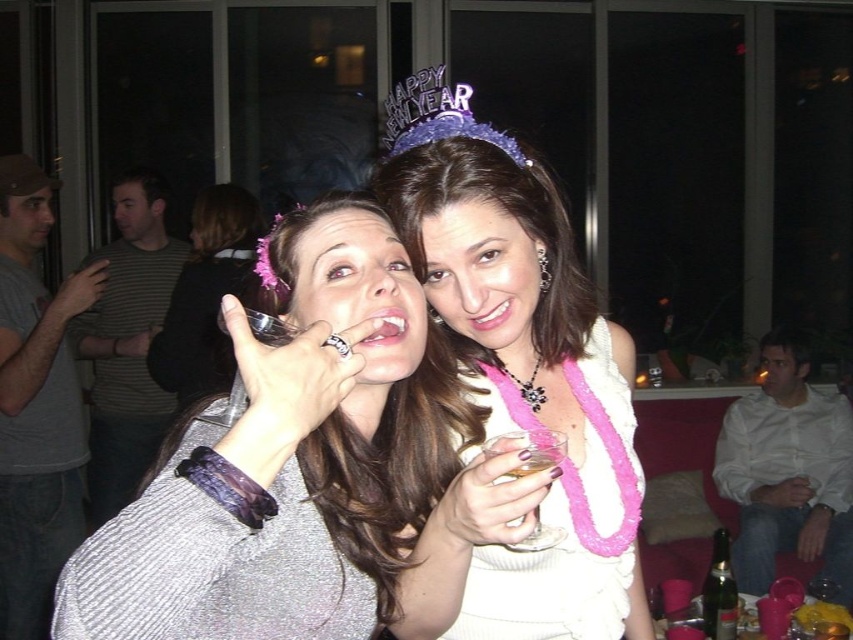
Does gray striped shirt at left appear under green glass bottle at lower right?

No.

Can you confirm if gray striped shirt at left is positioned to the right of green glass bottle at lower right?

No, gray striped shirt at left is not to the right of green glass bottle at lower right.

Between point (148, 445) and point (717, 550), which one is positioned behind?

Positioned behind is point (148, 445).

Identify the location of gray striped shirt at left. Image resolution: width=853 pixels, height=640 pixels. (126, 342).

Is the position of white shirt at center less distant than that of purple glittery tiara at upper center?

No, white shirt at center is further to the viewer.

Between white shirt at center and purple glittery tiara at upper center, which one is positioned lower?

white shirt at center

You are a GUI agent. You are given a task and a screenshot of the screen. Output one action in this format:
    pyautogui.click(x=<x>, y=<y>)
    Task: Click on the white shirt at center
    This screenshot has height=640, width=853.
    Given the screenshot: What is the action you would take?
    pyautogui.click(x=788, y=470)

Who is higher up, shiny silver dress at center or clear glass wine glass at center?

shiny silver dress at center is above.

Who is more forward, (x=527, y=483) or (x=523, y=545)?

Point (x=527, y=483) is more forward.

Find the location of a particular element. This screenshot has height=640, width=853. shiny silver dress at center is located at coordinates (306, 468).